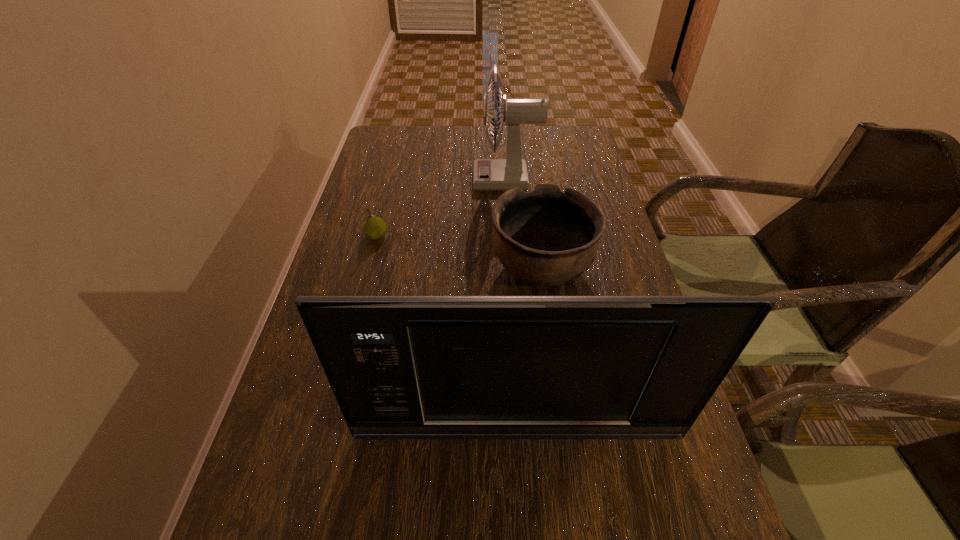
Locate an element on the screen. The width and height of the screenshot is (960, 540). microwave oven is located at coordinates (401, 367).

Identify the location of fan. (489, 174).

Image resolution: width=960 pixels, height=540 pixels. I want to click on pottery, so click(547, 237).

The image size is (960, 540). Identify the location of the leftmost object. (374, 228).

What are the coordinates of `pear` in the screenshot? It's located at (374, 228).

You are a GUI agent. You are given a task and a screenshot of the screen. Output one action in this format:
    pyautogui.click(x=<x>, y=<y>)
    Task: Click on the vacant space located on the front panel of the nearest object
    The height and width of the screenshot is (540, 960).
    Given the screenshot: What is the action you would take?
    pyautogui.click(x=520, y=481)

At what (x,y) coordinates should I click in order to perform the action: click on free space located 0.250m on the front-facing side of the farthest object. Please return your answer as a coordinate pair (x, y). The width and height of the screenshot is (960, 540). Looking at the image, I should click on (393, 180).

I want to click on free space located on the front-facing side of the farthest object, so coord(389,180).

The image size is (960, 540). In order to click on vacant space located 0.250m on the front-facing side of the farthest object in this screenshot , I will do `click(393, 180)`.

Find the location of a particular element. The height and width of the screenshot is (540, 960). vacant region located on the back of the pottery is located at coordinates (526, 158).